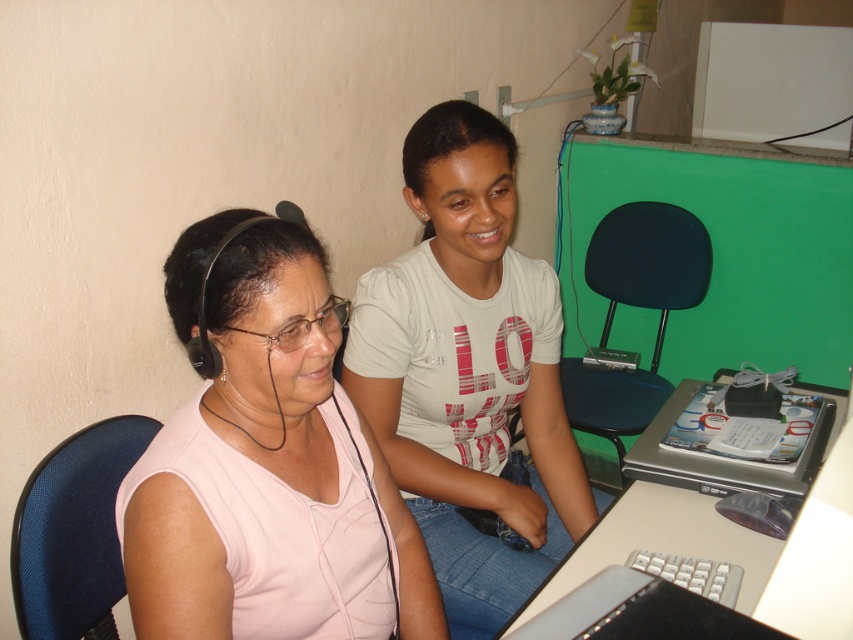
Question: Considering the relative positions of pink matte tank top at center and silver/black plastic laptop at lower right in the image provided, where is pink matte tank top at center located with respect to silver/black plastic laptop at lower right?

Choices:
 (A) left
 (B) right

Answer: (A)

Question: Can you confirm if white plastic table at lower right is positioned to the right of silver/black plastic laptop at lower right?

Choices:
 (A) yes
 (B) no

Answer: (B)

Question: Does white cotton shirt at center appear over silver/black plastic laptop at lower right?

Choices:
 (A) yes
 (B) no

Answer: (A)

Question: Among these objects, which one is farthest from the camera?

Choices:
 (A) white plastic table at lower right
 (B) white cotton shirt at center

Answer: (B)

Question: Among these points, which one is nearest to the camera?

Choices:
 (A) (463, 348)
 (B) (164, 284)
 (C) (686, 492)

Answer: (B)

Question: Which point is farther to the camera?

Choices:
 (A) pink matte tank top at center
 (B) white cotton shirt at center

Answer: (B)